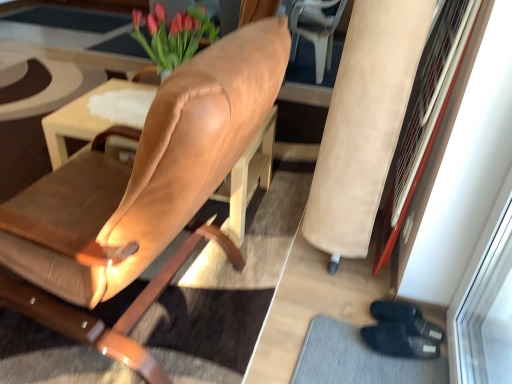
Find the location of a particular element. The image size is (512, 384). vacant point above black fabric doormat at lower right (from a real-world perspective) is located at coordinates (365, 356).